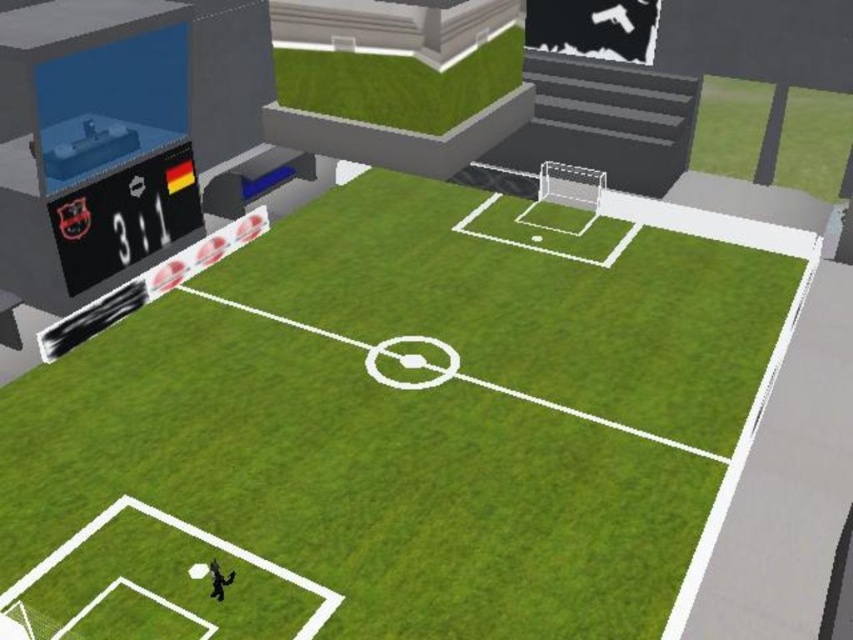
Question: Among these objects, which one is nearest to the camera?

Choices:
 (A) green grass football field at center
 (B) shiny black scoreboard at upper left

Answer: (A)

Question: Can you confirm if green grass football field at center is smaller than shiny black scoreboard at upper left?

Choices:
 (A) yes
 (B) no

Answer: (B)

Question: Which object is farther from the camera taking this photo?

Choices:
 (A) green grass football field at center
 (B) shiny black scoreboard at upper left

Answer: (B)

Question: Can you confirm if green grass football field at center is positioned to the right of shiny black scoreboard at upper left?

Choices:
 (A) no
 (B) yes

Answer: (B)

Question: Is green grass football field at center to the right of shiny black scoreboard at upper left from the viewer's perspective?

Choices:
 (A) no
 (B) yes

Answer: (B)